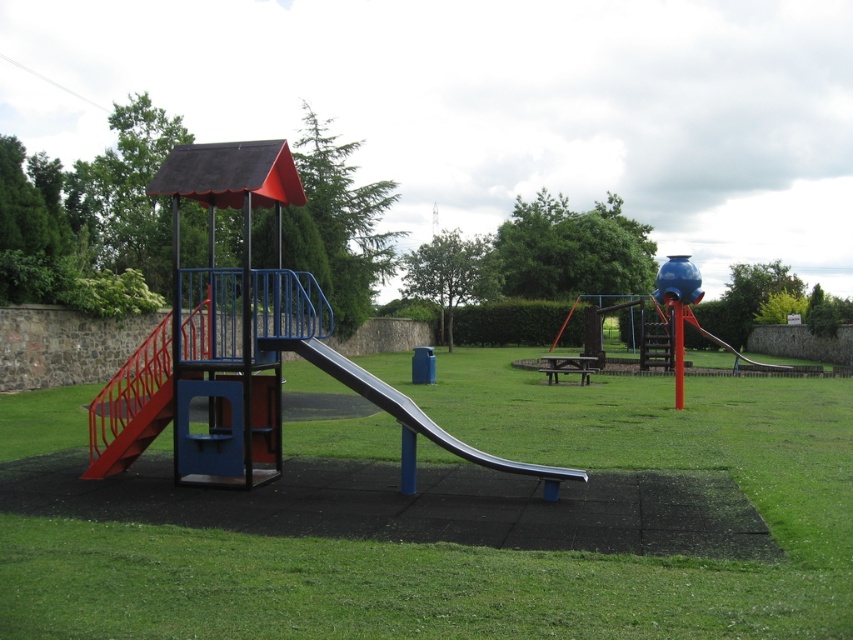
At what (x,y) coordinates should I click in order to perform the action: click on green grass at center. Please return your answer as a coordinate pair (x, y). Image resolution: width=853 pixels, height=640 pixels. Looking at the image, I should click on (490, 548).

Is point (318, 576) farther from viewer compared to point (346, 378)?

No, (318, 576) is closer to viewer.

Is point (291, 372) less distant than point (380, 384)?

No, it is behind (380, 384).

You are a GUI agent. You are given a task and a screenshot of the screen. Output one action in this format:
    pyautogui.click(x=<x>, y=<y>)
    Task: Click on the green grass at center
    The image size is (853, 640).
    Given the screenshot: What is the action you would take?
    pyautogui.click(x=490, y=548)